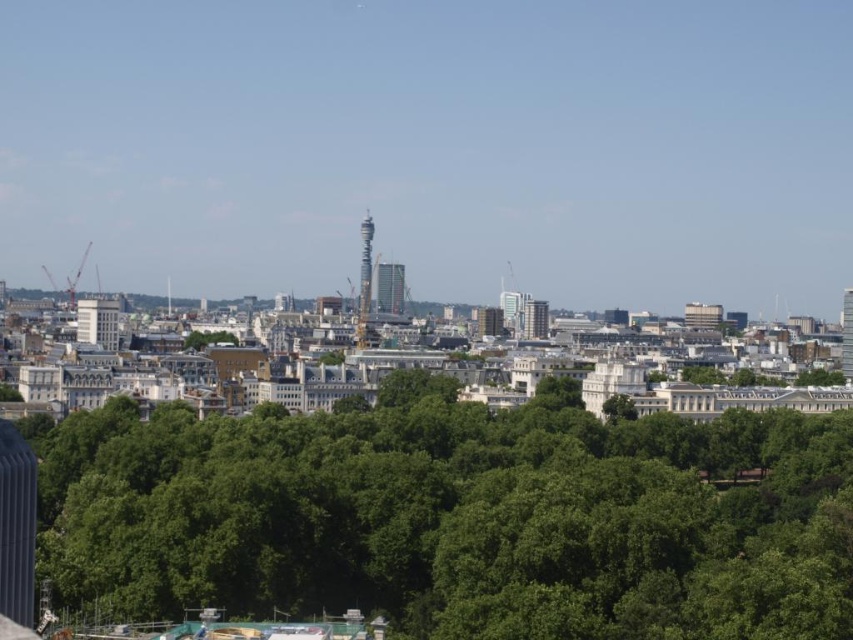
Question: Estimate the real-world distances between objects in this image. Which object is farther from the green leafy tree at right?

Choices:
 (A) silver metallic tower at center
 (B) glassy metallic tower at center
 (C) green leafy tree at center

Answer: (C)

Question: Is green leafy trees at center positioned in front of silver metallic tower at center?

Choices:
 (A) no
 (B) yes

Answer: (B)

Question: Can you confirm if silver metallic tower at center is positioned below metallic silver skyscraper at center?

Choices:
 (A) yes
 (B) no

Answer: (B)

Question: Considering the real-world distances, which object is closest to the green leafy tree at center?

Choices:
 (A) glassy metallic tower at center
 (B) metallic silver skyscraper at center
 (C) green leafy trees at center
 (D) green leafy tree at right

Answer: (A)

Question: Which of the following is the farthest from the observer?

Choices:
 (A) (392, 285)
 (B) (363, 284)

Answer: (A)

Question: Is silver metallic tower at center further to camera compared to metallic silver skyscraper at center?

Choices:
 (A) no
 (B) yes

Answer: (A)